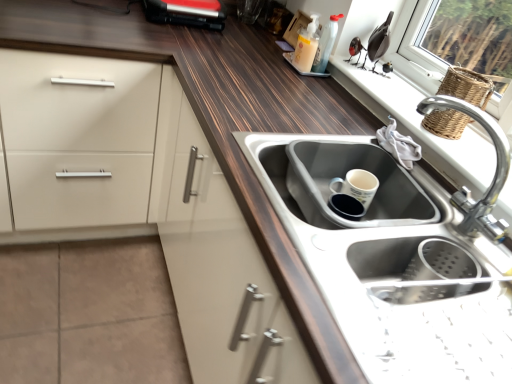
Identify the location of vacant region above wooden window sill at upper right (from a real-world perspective). Image resolution: width=512 pixels, height=384 pixels. (418, 112).